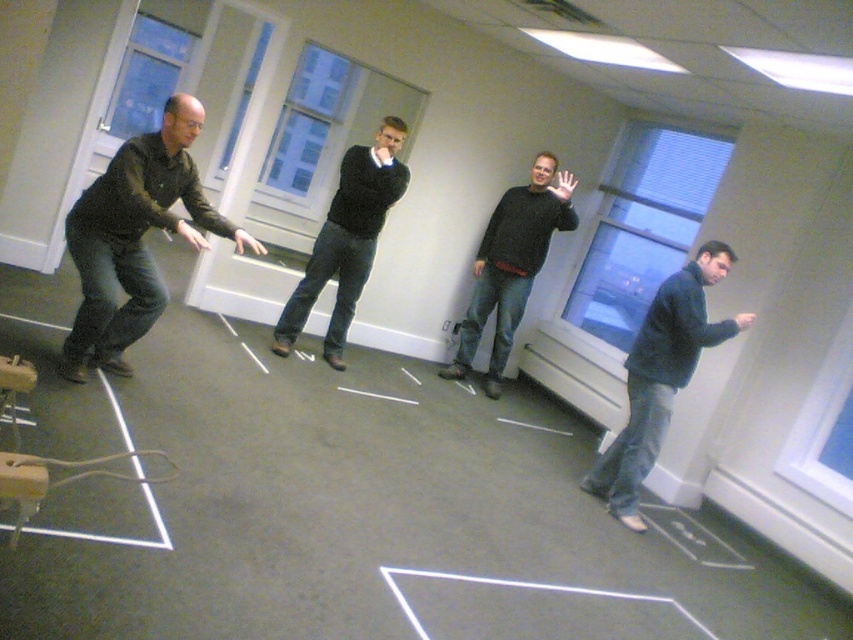
You are a photographer setting up for a group photo in the office. You need to position yourself so that you can capture both the dark blue jeans at lower right and the black sweater at center in the frame. Given their height difference, which object should you focus on to ensure both are fully visible?

The dark blue jeans at lower right is much taller than the black sweater at center. To ensure both are fully visible, you should focus on the dark blue jeans at lower right since it is taller and adjusting the camera angle to include its full height will naturally include the shorter black sweater at center.

You are organizing a photo shoot and need to place a small prop between the dark green sweater at left and the dark blue jeans at lower right. Based on their sizes, which object should the prop be closer to?

The prop should be closer to the dark green sweater at left because it has a larger width than the dark blue jeans at lower right, making it more prominent in the scene.

You are standing in the office and see two people wearing dark green sweater at left and dark gray sweater at center. Which one is positioned more to the left side?

The dark green sweater at left is positioned more to the left side than the dark gray sweater at center.